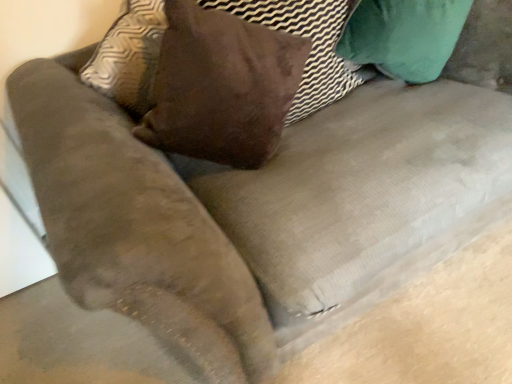
Question: Is point (315, 8) closer or farther from the camera than point (250, 71)?

Choices:
 (A) farther
 (B) closer

Answer: (A)

Question: From the image's perspective, is suede brown pillow at center positioned above or below brown suede pillow at upper center?

Choices:
 (A) above
 (B) below

Answer: (B)

Question: Is suede brown pillow at center wider or thinner than brown suede pillow at upper center?

Choices:
 (A) thin
 (B) wide

Answer: (A)

Question: Is brown suede pillow at upper center in front of or behind suede brown pillow at center in the image?

Choices:
 (A) front
 (B) behind

Answer: (A)

Question: From the image's perspective, relative to suede brown pillow at center, is brown suede pillow at upper center above or below?

Choices:
 (A) above
 (B) below

Answer: (A)

Question: Is brown suede pillow at upper center wider or thinner than suede brown pillow at center?

Choices:
 (A) wide
 (B) thin

Answer: (A)

Question: Is brown suede pillow at upper center to the left or to the right of suede brown pillow at center in the image?

Choices:
 (A) right
 (B) left

Answer: (B)